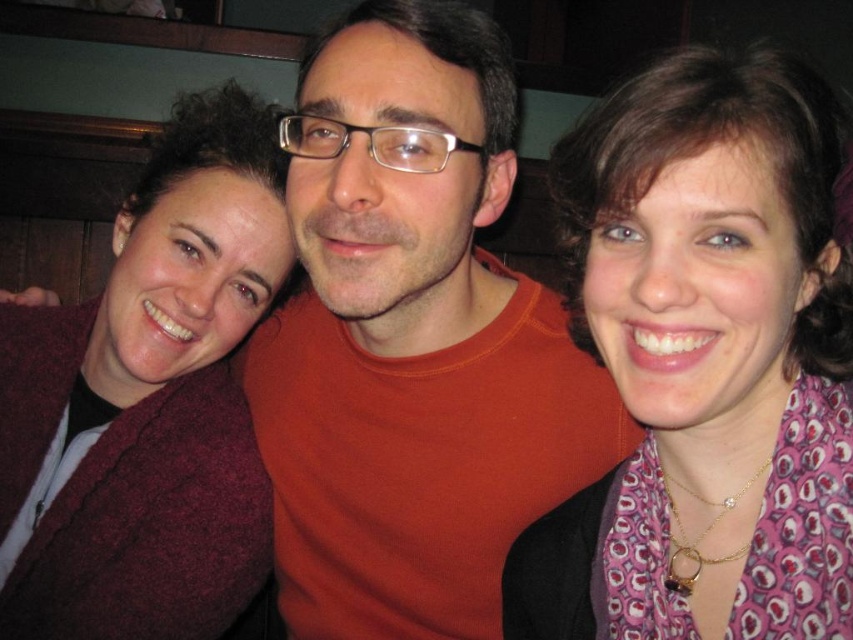
Question: Is matte orange t-shirt at center above purple patterned scarf at center?

Choices:
 (A) no
 (B) yes

Answer: (B)

Question: Which object is the farthest from the matte orange t-shirt at center?

Choices:
 (A) maroon sweater at left
 (B) purple patterned scarf at center

Answer: (B)

Question: Is matte orange t-shirt at center thinner than maroon sweater at left?

Choices:
 (A) no
 (B) yes

Answer: (A)

Question: Considering the relative positions of matte orange t-shirt at center and maroon sweater at left in the image provided, where is matte orange t-shirt at center located with respect to maroon sweater at left?

Choices:
 (A) below
 (B) above

Answer: (A)

Question: Estimate the real-world distances between objects in this image. Which object is closer to the matte orange t-shirt at center?

Choices:
 (A) purple patterned scarf at center
 (B) maroon sweater at left

Answer: (B)

Question: Which of the following is the closest to the observer?

Choices:
 (A) matte orange t-shirt at center
 (B) purple patterned scarf at center
 (C) maroon sweater at left

Answer: (B)